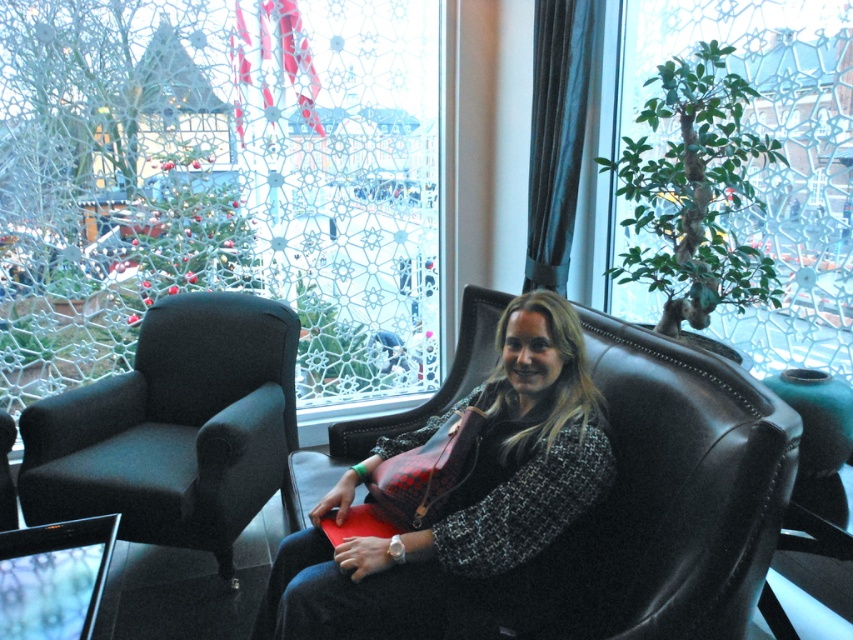
Who is higher up, matte black purse at center or dark gray fabric swivel chair at left?

Positioned higher is dark gray fabric swivel chair at left.

The image size is (853, 640). Identify the location of matte black purse at center. (460, 496).

Does transparent glass window at center appear on the right side of matte black purse at center?

No, transparent glass window at center is not to the right of matte black purse at center.

Who is shorter, transparent glass window at center or matte black purse at center?

matte black purse at center

Who is more distant from viewer, (138,300) or (477,522)?

Positioned behind is point (138,300).

Locate an element on the screen. transparent glass window at center is located at coordinates (218, 182).

Is matte black purse at center bigger than green leafy plant at upper right?

No.

Who is more distant from viewer, (x=532, y=528) or (x=844, y=129)?

The point (x=844, y=129) is more distant.

Describe the element at coordinates (460, 496) in the screenshot. The height and width of the screenshot is (640, 853). I see `matte black purse at center` at that location.

You are a GUI agent. You are given a task and a screenshot of the screen. Output one action in this format:
    pyautogui.click(x=<x>, y=<y>)
    Task: Click on the matte black purse at center
    This screenshot has width=853, height=640.
    Given the screenshot: What is the action you would take?
    pyautogui.click(x=460, y=496)